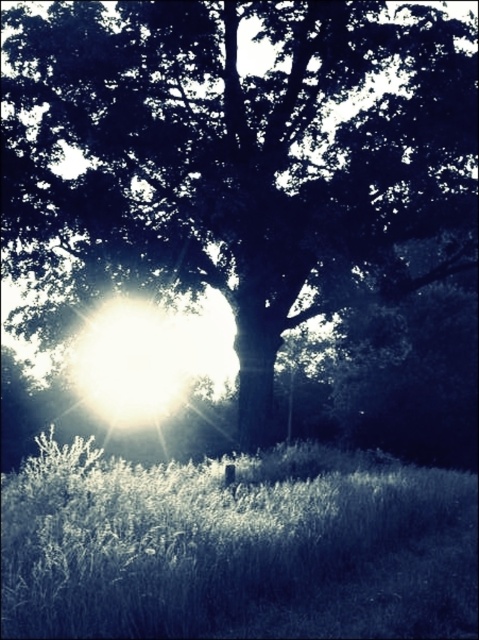
Question: Which point is farther from the camera taking this photo?

Choices:
 (A) (88, 484)
 (B) (285, 259)

Answer: (B)

Question: Is dark green leafy tree at center to the right of white soft grass at lower center from the viewer's perspective?

Choices:
 (A) yes
 (B) no

Answer: (B)

Question: Observing the image, what is the correct spatial positioning of dark green leafy tree at center in reference to white soft grass at lower center?

Choices:
 (A) right
 (B) left

Answer: (B)

Question: Where is dark green leafy tree at center located in relation to white soft grass at lower center in the image?

Choices:
 (A) left
 (B) right

Answer: (A)